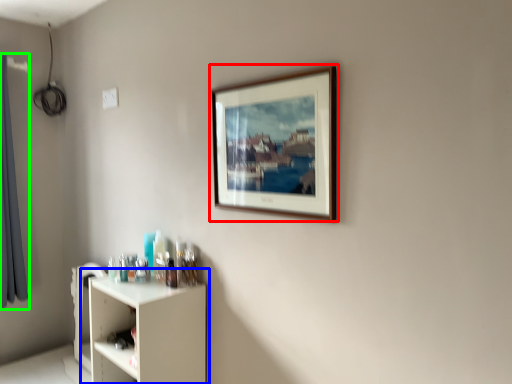
Question: Which object is positioned closest to picture frame (highlighted by a red box)? Select from shelf (highlighted by a blue box) and curtain (highlighted by a green box).

Choices:
 (A) shelf
 (B) curtain

Answer: (A)